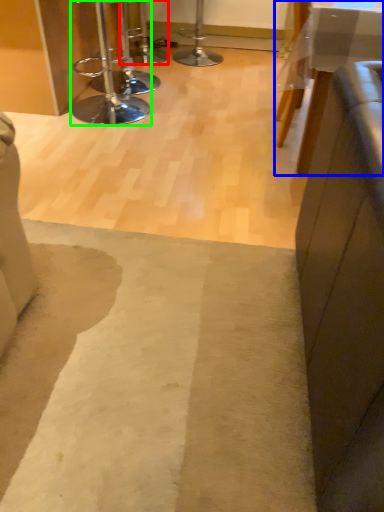
Question: Which object is positioned farthest from bar stool (highlighted by a red box)? Select from table (highlighted by a blue box) and stool (highlighted by a green box).

Choices:
 (A) table
 (B) stool

Answer: (A)